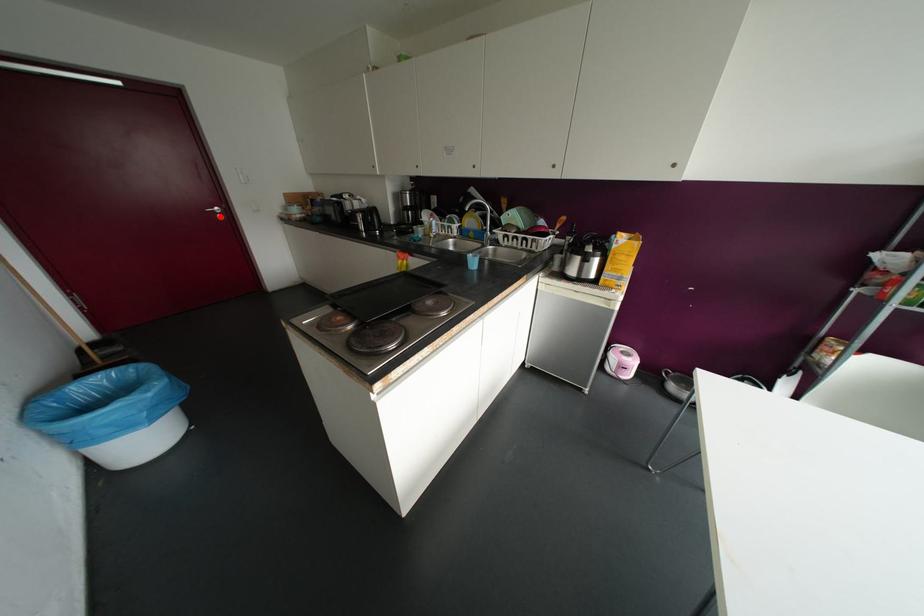
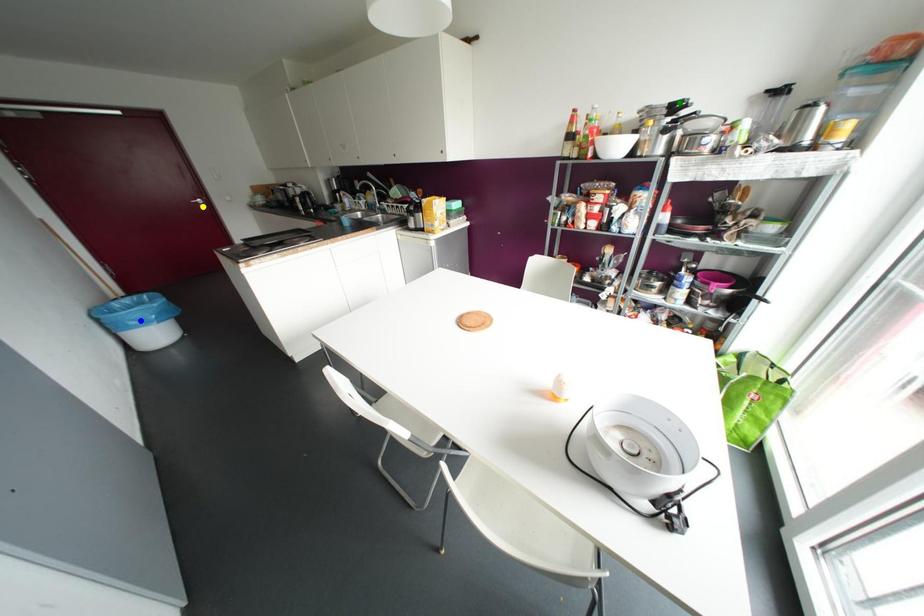
Question: I am providing you with two images of the same scene from different viewpoints. A red point is marked on the first image. You are given multiple points on the second image. Which spot in image 2 lines up with the point in image 1?

Choices:
 (A) green point
 (B) yellow point
 (C) blue point

Answer: (B)